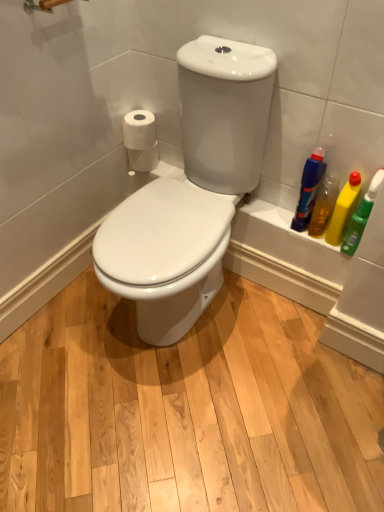
This screenshot has height=512, width=384. Identify the location of blank area to the left of translucent plastic bottle at right, which is the 4th cleaning product in right-to-left order. (272, 212).